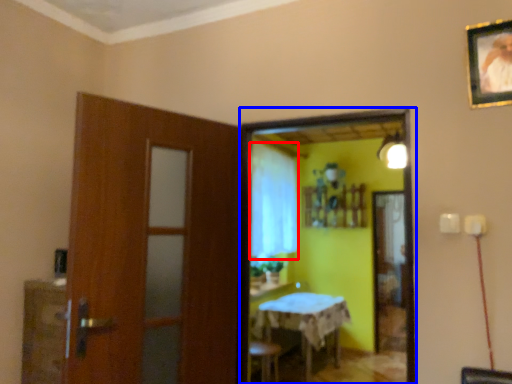
Question: Among these objects, which one is farthest to the camera, curtain (highlighted by a red box) or mirror (highlighted by a blue box)?

Choices:
 (A) curtain
 (B) mirror

Answer: (A)